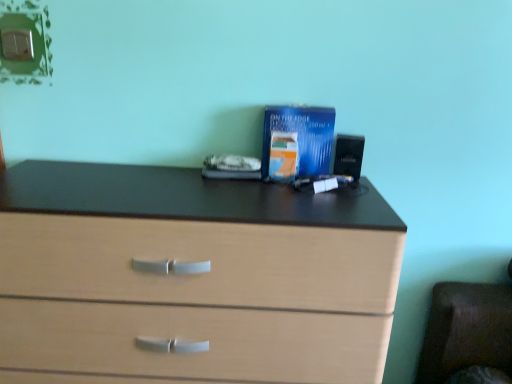
At what (x,y) coordinates should I click in order to perform the action: click on free space in front of blue glossy paperback book at center, the first paperback book positioned from the back. Please return your answer as a coordinate pair (x, y). Looking at the image, I should click on (298, 196).